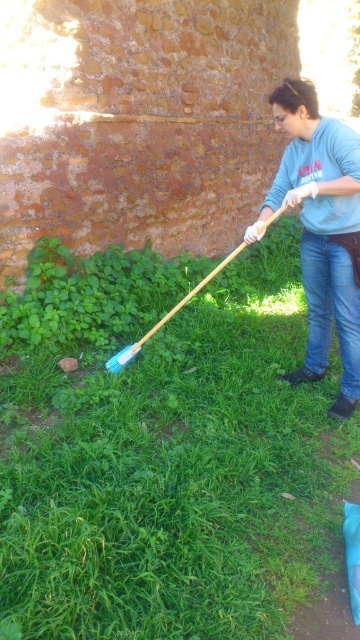
Question: Can you confirm if blue cotton sweater at center is positioned above blue plastic shovel at center?

Choices:
 (A) no
 (B) yes

Answer: (A)

Question: Based on their relative distances, which object is farther from the blue plastic shovel at center?

Choices:
 (A) blue cotton sweater at center
 (B) green grass at lower left

Answer: (A)

Question: Among these objects, which one is farthest from the camera?

Choices:
 (A) blue plastic shovel at center
 (B) green grass at lower left
 (C) blue cotton sweater at center

Answer: (A)

Question: Is green grass at lower left to the right of blue cotton sweater at center from the viewer's perspective?

Choices:
 (A) no
 (B) yes

Answer: (A)

Question: Which point is closer to the camera taking this photo?

Choices:
 (A) pos(163,509)
 (B) pos(119,368)
 (C) pos(352,372)

Answer: (A)

Question: Does blue cotton sweater at center have a smaller size compared to blue plastic shovel at center?

Choices:
 (A) yes
 (B) no

Answer: (A)